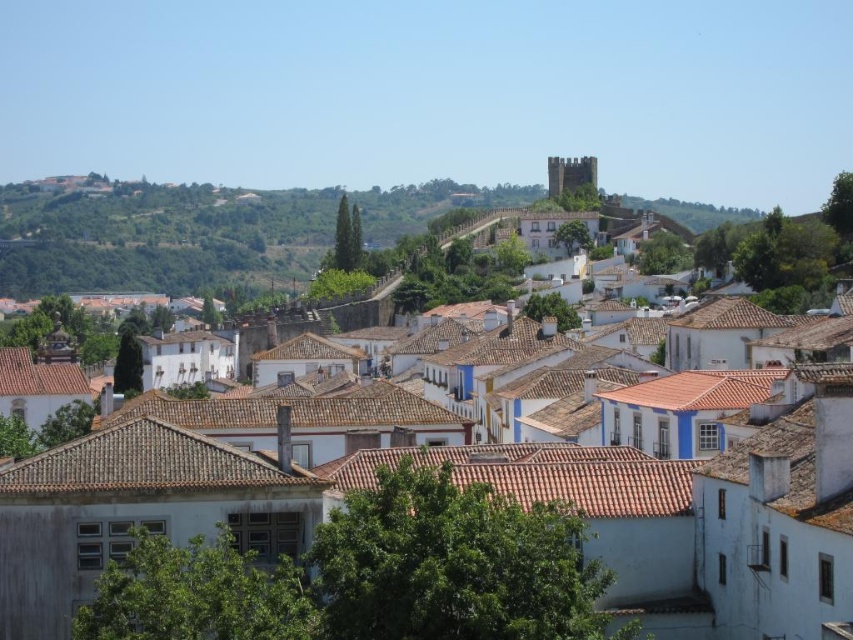
Does white tile roof at upper center have a smaller size compared to green grassy hillside at upper left?

Incorrect, white tile roof at upper center is not smaller in size than green grassy hillside at upper left.

Does point (337, 403) come in front of point (79, 243)?

Yes, it is.

At what (x,y) coordinates should I click in order to perform the action: click on white tile roof at upper center. Please return your answer as a coordinate pair (x, y). Looking at the image, I should click on (466, 481).